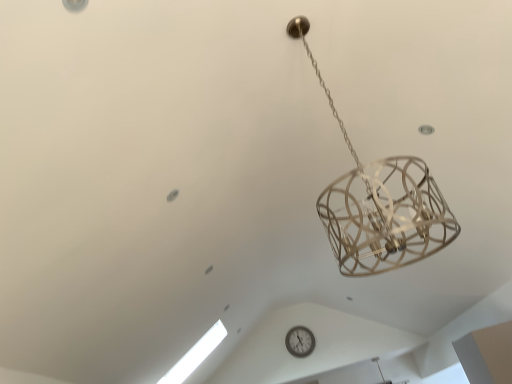
Question: From a real-world perspective, does transparent glass window at lower left sit lower than white plastic wall clock at center?

Choices:
 (A) yes
 (B) no

Answer: (A)

Question: Considering the relative sizes of transparent glass window at lower left and white plastic wall clock at center in the image provided, is transparent glass window at lower left taller than white plastic wall clock at center?

Choices:
 (A) yes
 (B) no

Answer: (A)

Question: Does transparent glass window at lower left touch white plastic wall clock at center?

Choices:
 (A) no
 (B) yes

Answer: (A)

Question: Can you confirm if transparent glass window at lower left is smaller than white plastic wall clock at center?

Choices:
 (A) yes
 (B) no

Answer: (B)

Question: Does transparent glass window at lower left come behind white plastic wall clock at center?

Choices:
 (A) yes
 (B) no

Answer: (B)

Question: Is transparent glass window at lower left positioned with its back to white plastic wall clock at center?

Choices:
 (A) yes
 (B) no

Answer: (B)

Question: Is white plastic wall clock at center with transparent glass window at lower left?

Choices:
 (A) yes
 (B) no

Answer: (B)

Question: From the image's perspective, would you say white plastic wall clock at center is positioned over transparent glass window at lower left?

Choices:
 (A) no
 (B) yes

Answer: (A)

Question: From the image's perspective, is white plastic wall clock at center under transparent glass window at lower left?

Choices:
 (A) yes
 (B) no

Answer: (A)

Question: Is white plastic wall clock at center bigger than transparent glass window at lower left?

Choices:
 (A) no
 (B) yes

Answer: (A)

Question: Considering the relative positions of white plastic wall clock at center and transparent glass window at lower left in the image provided, is white plastic wall clock at center to the left of transparent glass window at lower left from the viewer's perspective?

Choices:
 (A) yes
 (B) no

Answer: (B)

Question: Is white plastic wall clock at center facing away from transparent glass window at lower left?

Choices:
 (A) yes
 (B) no

Answer: (B)

Question: Does point (189, 360) appear closer or farther from the camera than point (290, 347)?

Choices:
 (A) farther
 (B) closer

Answer: (B)